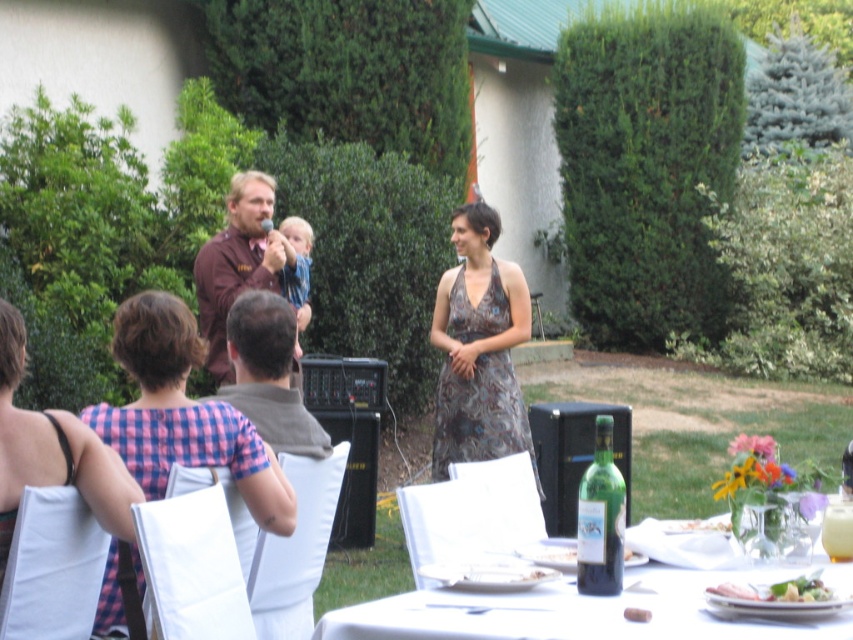
Which is more to the left, brown fabric shirt at upper center or white porcelain plate at lower center?

From the viewer's perspective, brown fabric shirt at upper center appears more on the left side.

Between brown fabric shirt at upper center and white porcelain plate at lower center, which one has more height?

With more height is brown fabric shirt at upper center.

Where is `brown fabric shirt at upper center`? brown fabric shirt at upper center is located at coordinates (236, 264).

The height and width of the screenshot is (640, 853). Identify the location of brown fabric shirt at upper center. (236, 264).

Can you confirm if pink checkered dress at left is wider than green glass bottle at lower center?

No.

Which is more to the left, pink checkered dress at left or green glass bottle at lower center?

Positioned to the left is pink checkered dress at left.

Identify the location of pink checkered dress at left. The width and height of the screenshot is (853, 640). (183, 413).

Can you confirm if brown textured dress at center is bigger than white porcelain plate at lower center?

Yes, brown textured dress at center is bigger than white porcelain plate at lower center.

Identify the location of brown textured dress at center. (479, 348).